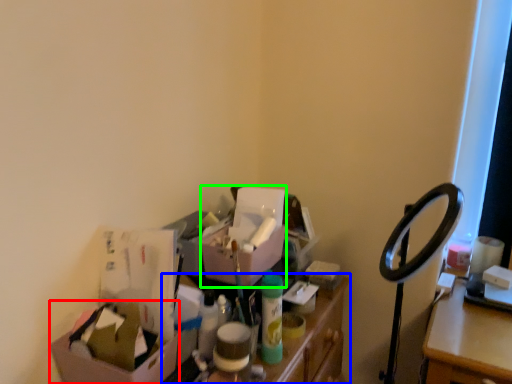
Question: Which is nearer to the box (highlighted by a red box)? furniture (highlighted by a blue box) or box (highlighted by a green box).

Choices:
 (A) furniture
 (B) box

Answer: (A)